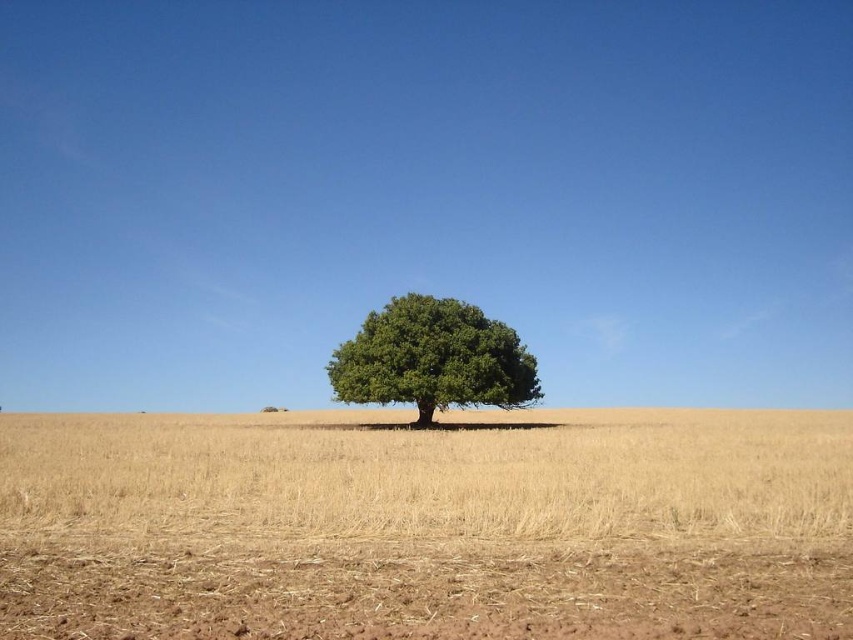
This screenshot has height=640, width=853. What do you see at coordinates (427, 525) in the screenshot?
I see `yellow dry grass at center` at bounding box center [427, 525].

The image size is (853, 640). What do you see at coordinates (427, 525) in the screenshot?
I see `yellow dry grass at center` at bounding box center [427, 525].

The height and width of the screenshot is (640, 853). Find the location of `yellow dry grass at center`. yellow dry grass at center is located at coordinates (427, 525).